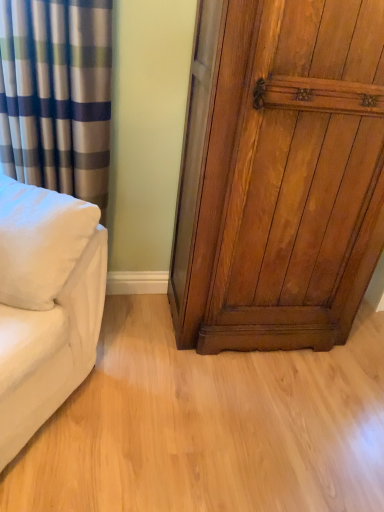
Question: Does silky blue-green striped curtain at left have a greater height compared to shiny brown wood door at right?

Choices:
 (A) yes
 (B) no

Answer: (B)

Question: Considering the relative sizes of silky blue-green striped curtain at left and shiny brown wood door at right in the image provided, is silky blue-green striped curtain at left shorter than shiny brown wood door at right?

Choices:
 (A) yes
 (B) no

Answer: (A)

Question: Is silky blue-green striped curtain at left smaller than shiny brown wood door at right?

Choices:
 (A) yes
 (B) no

Answer: (A)

Question: From the image's perspective, does silky blue-green striped curtain at left appear lower than shiny brown wood door at right?

Choices:
 (A) yes
 (B) no

Answer: (B)

Question: Considering the relative positions of silky blue-green striped curtain at left and shiny brown wood door at right in the image provided, is silky blue-green striped curtain at left behind shiny brown wood door at right?

Choices:
 (A) no
 (B) yes

Answer: (B)

Question: Would you say silky blue-green striped curtain at left contains shiny brown wood door at right?

Choices:
 (A) no
 (B) yes

Answer: (A)

Question: Is light wood floor at center turned away from silky blue-green striped curtain at left?

Choices:
 (A) no
 (B) yes

Answer: (A)

Question: Is light wood floor at center to the right of silky blue-green striped curtain at left from the viewer's perspective?

Choices:
 (A) yes
 (B) no

Answer: (A)

Question: Is light wood floor at center far away from silky blue-green striped curtain at left?

Choices:
 (A) no
 (B) yes

Answer: (A)

Question: From the image's perspective, is light wood floor at center located above silky blue-green striped curtain at left?

Choices:
 (A) no
 (B) yes

Answer: (A)

Question: Considering the relative positions of light wood floor at center and silky blue-green striped curtain at left in the image provided, is light wood floor at center in front of silky blue-green striped curtain at left?

Choices:
 (A) yes
 (B) no

Answer: (A)

Question: Is light wood floor at center wider than silky blue-green striped curtain at left?

Choices:
 (A) yes
 (B) no

Answer: (A)

Question: Considering the relative sizes of white soft pillow at left and shiny brown wood door at right in the image provided, is white soft pillow at left thinner than shiny brown wood door at right?

Choices:
 (A) no
 (B) yes

Answer: (B)